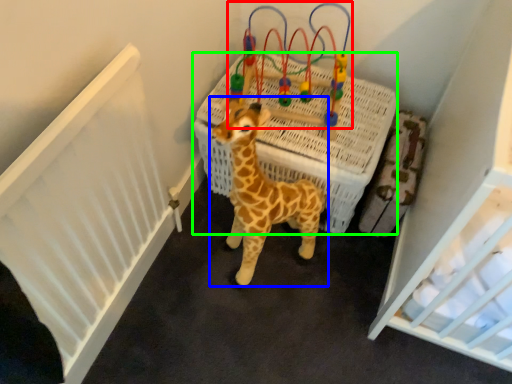
Question: Which object is the farthest from toy (highlighted by a red box)? Choose among these: giraffe (highlighted by a blue box) or infant bed (highlighted by a green box).

Choices:
 (A) giraffe
 (B) infant bed

Answer: (A)